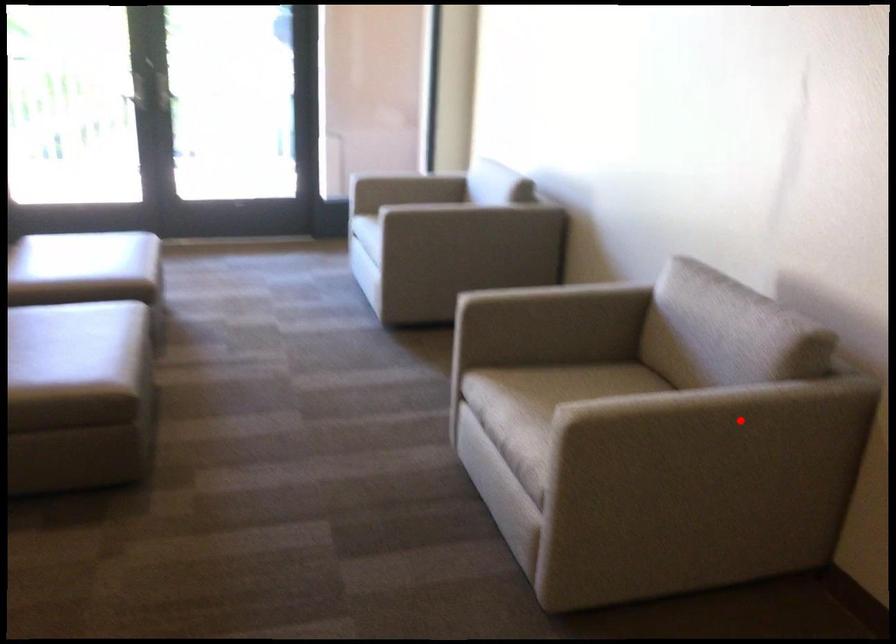
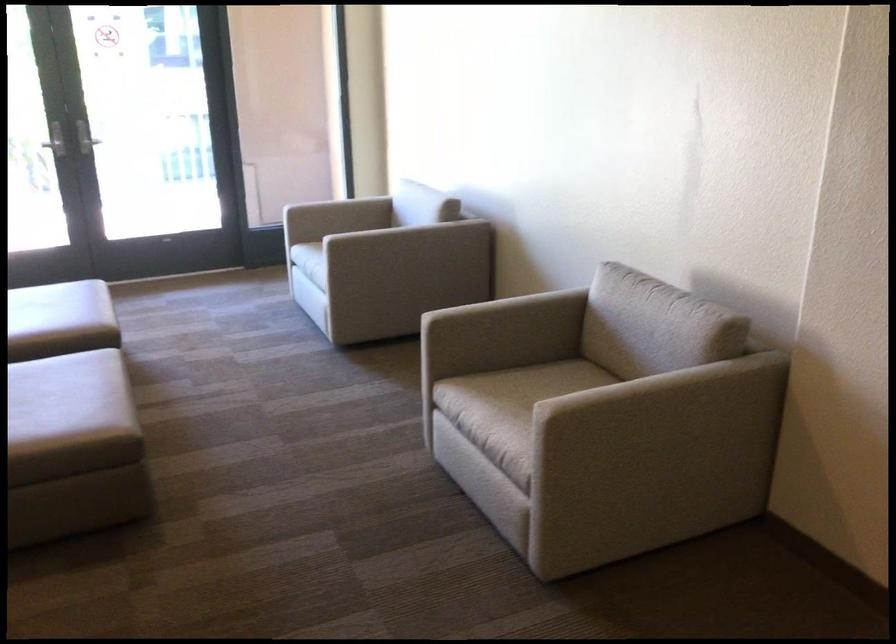
Find the pixel in the second image that matches the highlighted location in the first image.

(681, 399)